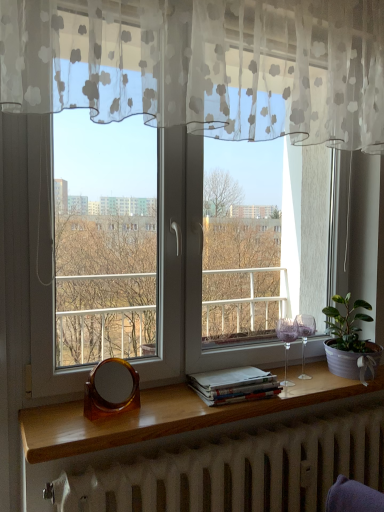
This screenshot has width=384, height=512. Identify the location of free region on the left part of white paper stack at lower center. (170, 399).